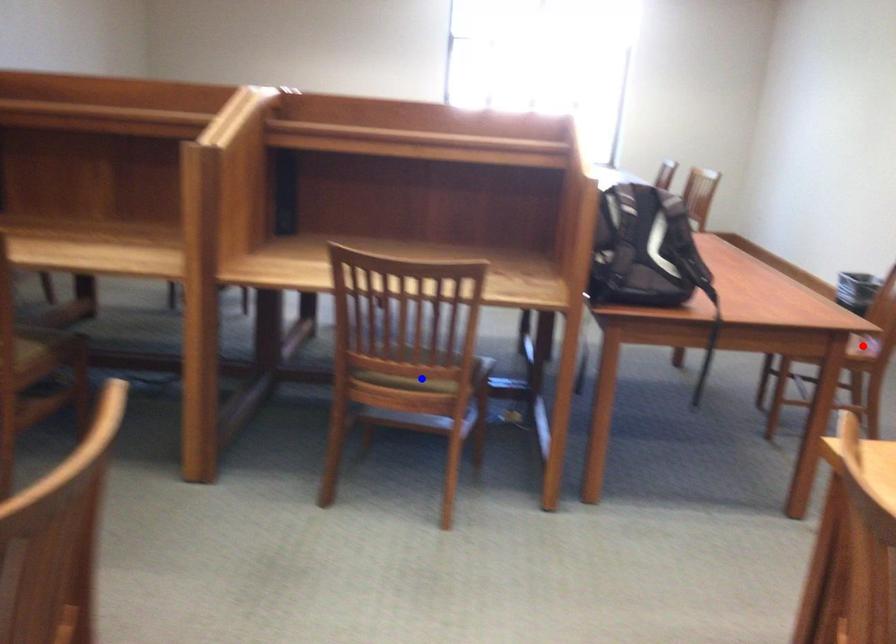
Question: In the image, two points are highlighted. Which point is nearer to the camera? Reply with the corresponding letter.

Choices:
 (A) blue point
 (B) red point

Answer: (A)